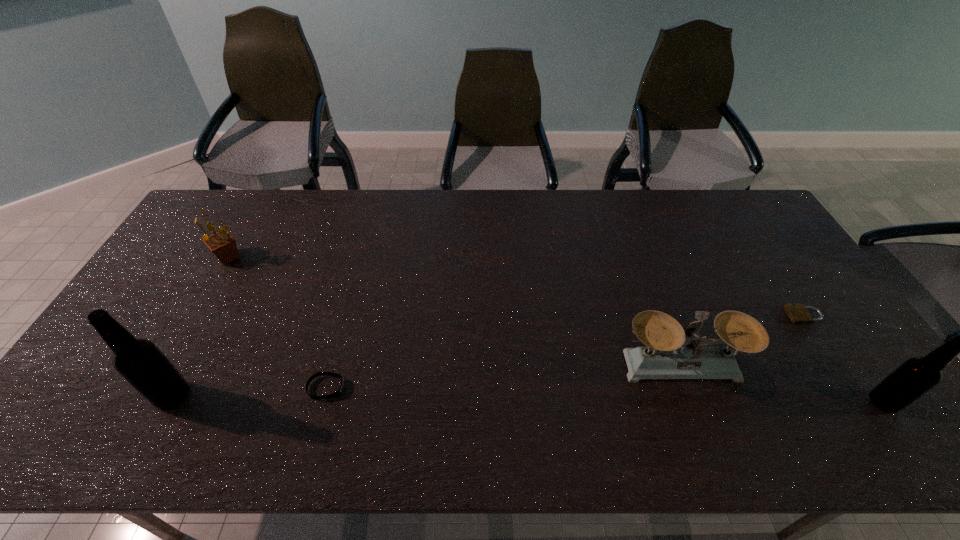
At what (x,y) coordinates should I click in order to perform the action: click on free space between the padlock and the shorter beer bottle. Please return your answer as a coordinate pair (x, y). Looking at the image, I should click on (844, 359).

I want to click on vacant area that lies between the third object from left to right and the shorter beer bottle, so [605, 395].

The image size is (960, 540). What are the coordinates of `vacant space in between the fourth object from right to left and the sunflower` in the screenshot? It's located at (277, 323).

The width and height of the screenshot is (960, 540). Find the location of `vacant area that lies between the shorter beer bottle and the sunflower`. vacant area that lies between the shorter beer bottle and the sunflower is located at coordinates (556, 330).

This screenshot has height=540, width=960. I want to click on free area in between the fifth shortest object and the third object from left to right, so click(x=605, y=395).

Locate an element on the screen. The image size is (960, 540). vacant space that's between the right beer bottle and the fourth object from left to right is located at coordinates (782, 383).

Identify the location of empty space that is in between the sunflower and the wristband. (277, 323).

Locate which object is the fourth closest to the second tallest object. Please provide its 2D coordinates. Your answer should be formatted as a tuple, i.e. [(x, y)], where the tuple contains the x and y coordinates of a point satisfying the conditions above.

[(140, 362)]

Locate which object ranks fourth in proximity to the left beer bottle. Please provide its 2D coordinates. Your answer should be formatted as a tuple, i.e. [(x, y)], where the tuple contains the x and y coordinates of a point satisfying the conditions above.

[(797, 312)]

This screenshot has width=960, height=540. I want to click on vacant space that satisfies the following two spatial constraints: 1. on the front-facing side of the shorter beer bottle; 2. on the right side of the scale, so click(695, 402).